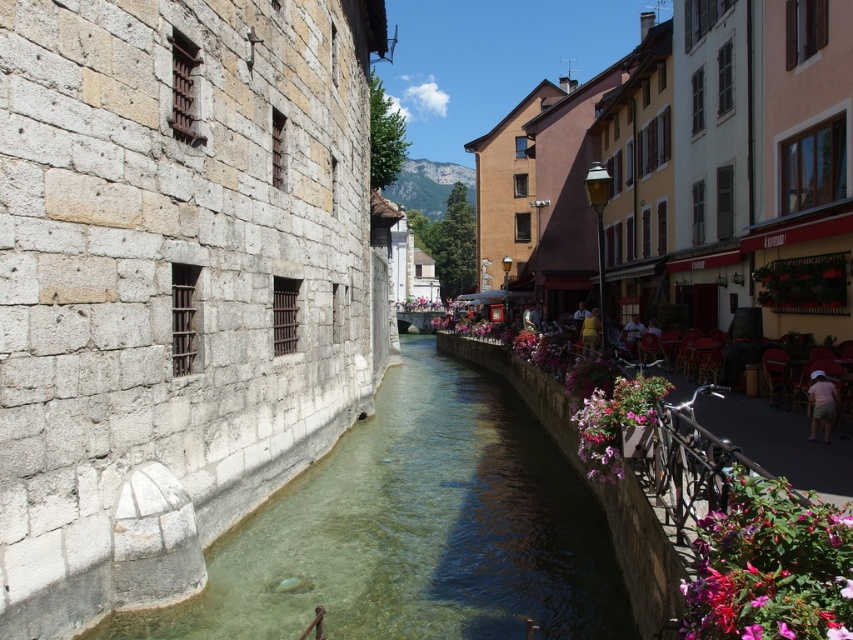
Question: Which of the following is the farthest from the observer?

Choices:
 (A) pink cotton shorts at lower right
 (B) yellow fabric person at center

Answer: (B)

Question: Is pink fabric flowers at right positioned before yellow fabric person at center?

Choices:
 (A) no
 (B) yes

Answer: (B)

Question: Which point is farther to the camera?

Choices:
 (A) (607, 403)
 (B) (584, 342)
 (C) (144, 612)

Answer: (B)

Question: Which object is farther from the camera taking this photo?

Choices:
 (A) pink fabric flowers at right
 (B) clear stone stream at center
 (C) yellow fabric person at center

Answer: (C)

Question: Observing the image, what is the correct spatial positioning of pink matte flowers at lower right in reference to pink cotton shorts at lower right?

Choices:
 (A) left
 (B) right

Answer: (A)

Question: Is clear stone stream at center above yellow fabric person at center?

Choices:
 (A) no
 (B) yes

Answer: (A)